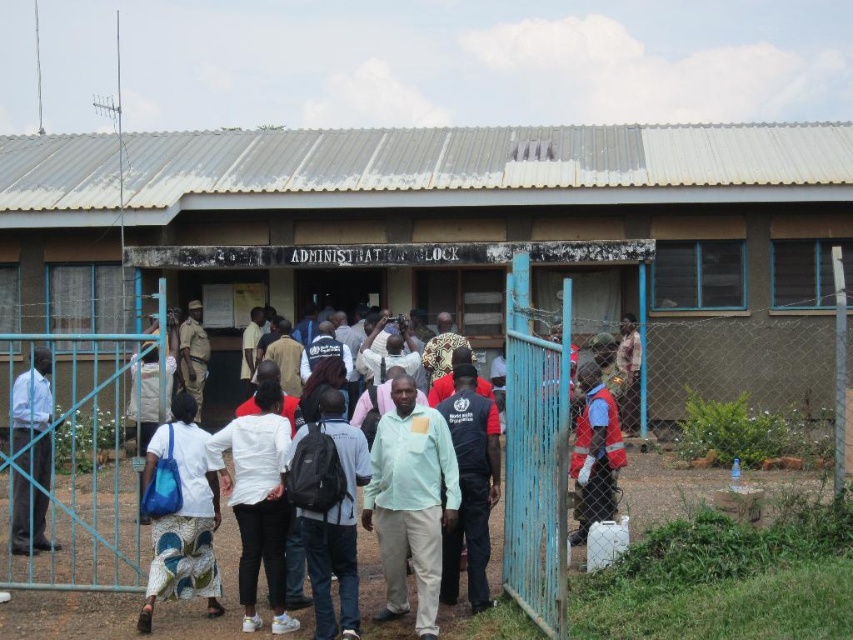
Question: Which point is farther to the camera?

Choices:
 (A) blue metal gate at center
 (B) dark brown uniform at center
 (C) white matte shirt at center
 (D) light green fabric shirt at center

Answer: (B)

Question: Is blue fabric shirt at center to the right of light blue shirt at left from the viewer's perspective?

Choices:
 (A) no
 (B) yes

Answer: (B)

Question: Which object is closer to the camera taking this photo?

Choices:
 (A) camouflage fabric shirt at center
 (B) reflective orange vest at right

Answer: (B)

Question: Is white matte shirt at center bigger than reflective orange vest at right?

Choices:
 (A) yes
 (B) no

Answer: (A)

Question: Which object is the closest to the blue metal gate at center?

Choices:
 (A) blue fabric shirt at center
 (B) black backpack at center
 (C) light blue shirt at left

Answer: (A)

Question: Is blue metal gate at center above black backpack at center?

Choices:
 (A) yes
 (B) no

Answer: (B)